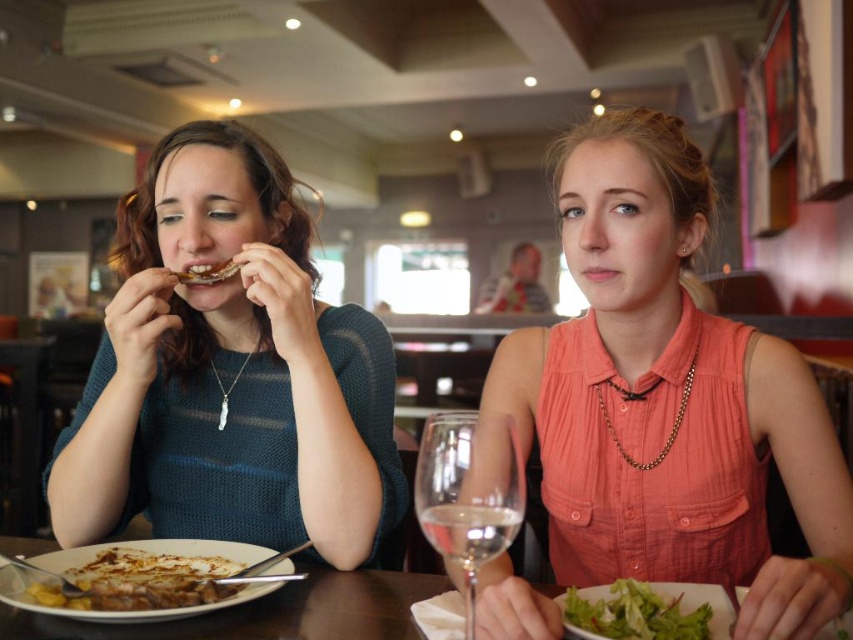
Question: Which point is farther from the camera taking this photo?

Choices:
 (A) (683, 502)
 (B) (450, 435)
 (C) (297, 632)
 (D) (132, 604)

Answer: (A)

Question: Estimate the real-world distances between objects in this image. Which object is farther from the brown crispy bread at center?

Choices:
 (A) green leafy salad at lower center
 (B) transparent glass wine glass at lower center

Answer: (A)

Question: Which point is closer to the camera?

Choices:
 (A) (718, 620)
 (B) (440, 506)
 (C) (549, 592)

Answer: (B)

Question: Can you confirm if golden brown bread at lower left is smaller than green leafy salad at lower center?

Choices:
 (A) no
 (B) yes

Answer: (B)

Question: Can you confirm if golden brown bread at lower left is positioned below brown crispy bread at center?

Choices:
 (A) yes
 (B) no

Answer: (A)

Question: Is knitted teal sweater at left above wooden table at center?

Choices:
 (A) yes
 (B) no

Answer: (A)